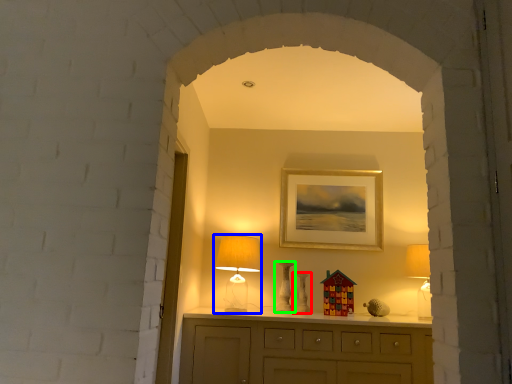
Question: Which object is positioned closest to vase (highlighted by a red box)? Select from table lamp (highlighted by a blue box) and vase (highlighted by a green box).

Choices:
 (A) table lamp
 (B) vase

Answer: (B)